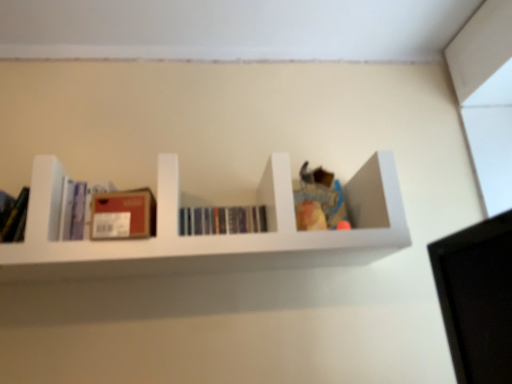
What do you see at coordinates (123, 215) in the screenshot? This screenshot has height=384, width=512. I see `matte cardboard box at center left` at bounding box center [123, 215].

Where is `matte purple book at left, the 1th book in the left-to-right sequence`? The width and height of the screenshot is (512, 384). matte purple book at left, the 1th book in the left-to-right sequence is located at coordinates (77, 207).

Looking at this image, measure the distance between hardcover books at center, the first book in the right-to-left sequence, and camera.

They are 1.17 meters apart.

Identify the location of matte cardboard box at center left. The image size is (512, 384). (123, 215).

From a real-world perspective, is matte purple book at left, the 1th book in the left-to-right sequence, above or below white matte shelf at center?

matte purple book at left, the 1th book in the left-to-right sequence, is situated higher than white matte shelf at center in the real world.

You are a GUI agent. You are given a task and a screenshot of the screen. Output one action in this format:
    pyautogui.click(x=<x>, y=<y>)
    Task: Click on the shelf below the matte purple book at left, the 1th book in the left-to-right sequence (from the image's perspective)
    This screenshot has width=512, height=384.
    Given the screenshot: What is the action you would take?
    pyautogui.click(x=217, y=236)

Are matte purple book at left, the 1th book in the left-to-right sequence, and white matte shelf at center located far from each other?

No, there isn't a large distance between matte purple book at left, the 1th book in the left-to-right sequence, and white matte shelf at center.

Is point (196, 211) in front of point (77, 185)?

No, it is behind (77, 185).

Measure the distance between hardcover books at center, the 2th book when ordered from left to right, and matte purple book at left, which is the second book in right-to-left order.

The distance of hardcover books at center, the 2th book when ordered from left to right, from matte purple book at left, which is the second book in right-to-left order, is 12.54 inches.

From the picture: Is hardcover books at center, the 2th book when ordered from left to right, touching matte purple book at left, the 1th book in the left-to-right sequence?

No, hardcover books at center, the 2th book when ordered from left to right, is not touching matte purple book at left, the 1th book in the left-to-right sequence.

In terms of size, does hardcover books at center, the first book in the right-to-left sequence, appear bigger or smaller than matte purple book at left, which is the second book in right-to-left order?

hardcover books at center, the first book in the right-to-left sequence, is smaller than matte purple book at left, which is the second book in right-to-left order.

Between matte cardboard box at center left and matte purple book at left, which is the second book in right-to-left order, which one is positioned behind?

Positioned behind is matte purple book at left, which is the second book in right-to-left order.

Consider the image. From a real-world perspective, is matte cardboard box at center left positioned under matte purple book at left, the 1th book in the left-to-right sequence, based on gravity?

Yes, from a real-world perspective, matte cardboard box at center left is beneath matte purple book at left, the 1th book in the left-to-right sequence.

Who is bigger, matte cardboard box at center left or matte purple book at left, which is the second book in right-to-left order?

matte cardboard box at center left is bigger.

Is point (115, 196) closer or farther from the camera than point (82, 225)?

Point (115, 196) is closer to the camera than point (82, 225).

Is matte purple book at left, the 1th book in the left-to-right sequence, in contact with hardcover books at center, the first book in the right-to-left sequence?

No, matte purple book at left, the 1th book in the left-to-right sequence, is not in contact with hardcover books at center, the first book in the right-to-left sequence.

Is matte purple book at left, which is the second book in right-to-left order, oriented towards hardcover books at center, the first book in the right-to-left sequence?

No, matte purple book at left, which is the second book in right-to-left order, does not turn towards hardcover books at center, the first book in the right-to-left sequence.

Can you confirm if matte purple book at left, which is the second book in right-to-left order, is taller than hardcover books at center, the first book in the right-to-left sequence?

Correct, matte purple book at left, which is the second book in right-to-left order, is much taller as hardcover books at center, the first book in the right-to-left sequence.

From a real-world perspective, is matte purple book at left, the 1th book in the left-to-right sequence, physically located above or below hardcover books at center, the 2th book when ordered from left to right?

matte purple book at left, the 1th book in the left-to-right sequence, is above hardcover books at center, the 2th book when ordered from left to right.

How different are the orientations of white matte shelf at center and hardcover books at center, the first book in the right-to-left sequence, in degrees?

They differ by 2.88 degrees in their facing directions.

How far apart are white matte shelf at center and hardcover books at center, the first book in the right-to-left sequence?

white matte shelf at center is 19.07 centimeters from hardcover books at center, the first book in the right-to-left sequence.

Is white matte shelf at center oriented away from hardcover books at center, the first book in the right-to-left sequence?

Yes, white matte shelf at center is facing away from hardcover books at center, the first book in the right-to-left sequence.

Does white matte shelf at center appear on the left side of hardcover books at center, the 2th book when ordered from left to right?

Yes, white matte shelf at center is to the left of hardcover books at center, the 2th book when ordered from left to right.

Is hardcover books at center, the first book in the right-to-left sequence, surrounded by matte cardboard box at center left?

Actually, hardcover books at center, the first book in the right-to-left sequence, is outside matte cardboard box at center left.

Considering the positions of points (138, 234) and (217, 215), is point (138, 234) farther from camera compared to point (217, 215)?

No.

Is matte cardboard box at center left not near hardcover books at center, the 2th book when ordered from left to right?

No, there isn't a large distance between matte cardboard box at center left and hardcover books at center, the 2th book when ordered from left to right.

Could you measure the distance between matte cardboard box at center left and hardcover books at center, the first book in the right-to-left sequence?

matte cardboard box at center left and hardcover books at center, the first book in the right-to-left sequence, are 22.20 centimeters apart.

Is white matte shelf at center inside or outside of matte purple book at left, the 1th book in the left-to-right sequence?

white matte shelf at center is spatially situated outside matte purple book at left, the 1th book in the left-to-right sequence.

Does white matte shelf at center come behind matte purple book at left, which is the second book in right-to-left order?

No, white matte shelf at center is in front of matte purple book at left, which is the second book in right-to-left order.

Which book is the 1st one when counting from the back of the white matte shelf at center? Please provide its 2D coordinates.

[(77, 207)]

Where is `book lying on the left of hardcover books at center, the 2th book when ordered from left to right`? The image size is (512, 384). book lying on the left of hardcover books at center, the 2th book when ordered from left to right is located at coordinates (77, 207).

Considering their positions, is matte purple book at left, which is the second book in right-to-left order, positioned further to matte cardboard box at center left than hardcover books at center, the first book in the right-to-left sequence?

hardcover books at center, the first book in the right-to-left sequence.

Looking at the image, which one is located further to white matte shelf at center, matte cardboard box at center left or hardcover books at center, the 2th book when ordered from left to right?

The object further to white matte shelf at center is matte cardboard box at center left.

Based on their spatial positions, is matte purple book at left, the 1th book in the left-to-right sequence, or white matte shelf at center closer to matte cardboard box at center left?

matte purple book at left, the 1th book in the left-to-right sequence, is closer to matte cardboard box at center left.

From the image, which object appears to be farther from matte cardboard box at center left, hardcover books at center, the first book in the right-to-left sequence, or white matte shelf at center?

The object further to matte cardboard box at center left is white matte shelf at center.

Considering their positions, is matte cardboard box at center left positioned further to matte purple book at left, the 1th book in the left-to-right sequence, than hardcover books at center, the first book in the right-to-left sequence?

Among the two, hardcover books at center, the first book in the right-to-left sequence, is located further to matte purple book at left, the 1th book in the left-to-right sequence.

Estimate the real-world distances between objects in this image. Which object is closer to matte purple book at left, which is the second book in right-to-left order, white matte shelf at center or matte cardboard box at center left?

The object closer to matte purple book at left, which is the second book in right-to-left order, is matte cardboard box at center left.

When comparing their distances from matte cardboard box at center left, does hardcover books at center, the 2th book when ordered from left to right, or matte purple book at left, which is the second book in right-to-left order, seem closer?

Among the two, matte purple book at left, which is the second book in right-to-left order, is located nearer to matte cardboard box at center left.

When comparing their distances from hardcover books at center, the 2th book when ordered from left to right, does matte cardboard box at center left or matte purple book at left, the 1th book in the left-to-right sequence, seem further?

matte purple book at left, the 1th book in the left-to-right sequence, is further to hardcover books at center, the 2th book when ordered from left to right.

The width and height of the screenshot is (512, 384). Find the location of `paperback book between white matte shelf at center and hardcover books at center, the first book in the right-to-left sequence, in the front-back direction`. paperback book between white matte shelf at center and hardcover books at center, the first book in the right-to-left sequence, in the front-back direction is located at coordinates (123, 215).

The image size is (512, 384). I want to click on paperback book located between matte purple book at left, the 1th book in the left-to-right sequence, and hardcover books at center, the 2th book when ordered from left to right, in the left-right direction, so click(123, 215).

The height and width of the screenshot is (384, 512). I want to click on paperback book between matte purple book at left, which is the second book in right-to-left order, and white matte shelf at center, in the horizontal direction, so click(123, 215).

Identify the location of shelf between matte purple book at left, the 1th book in the left-to-right sequence, and hardcover books at center, the 2th book when ordered from left to right, from left to right. The height and width of the screenshot is (384, 512). (217, 236).